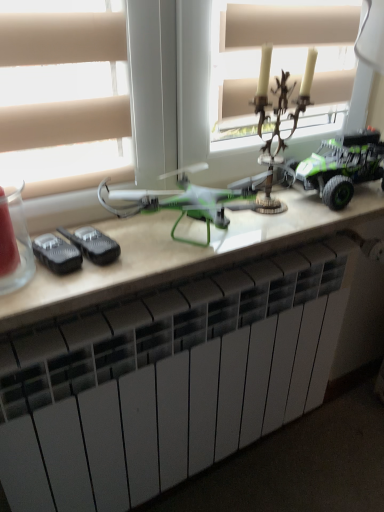
Find the location of a particular element. vacant region below green matte toy truck at right, marked as the 2th toy in a left-to-right arrangement (from a real-world perspective) is located at coordinates (339, 205).